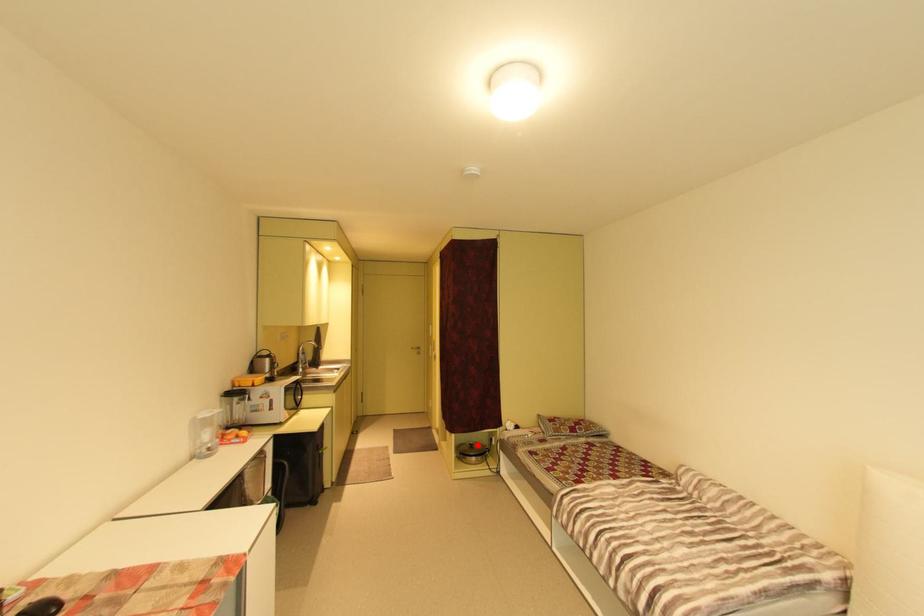
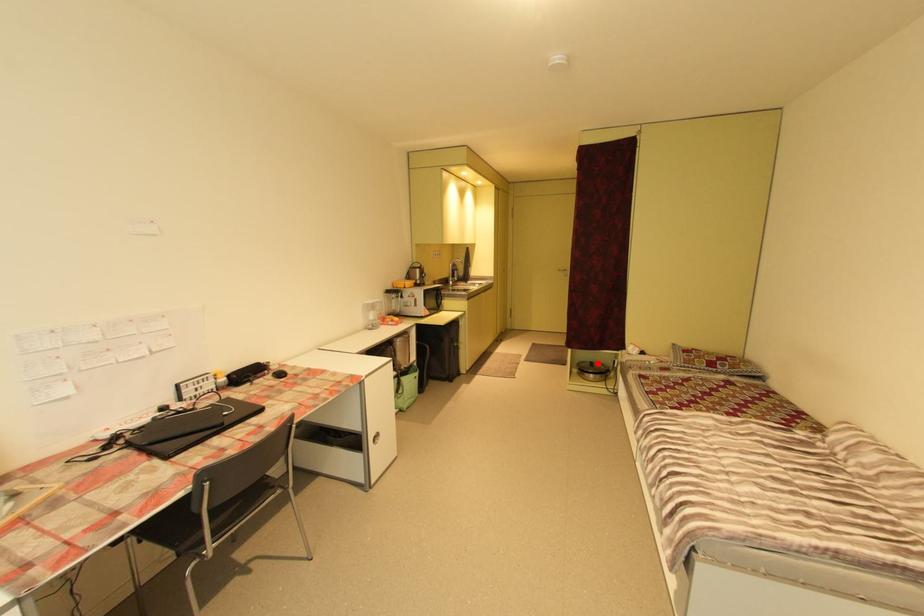
I am providing you with two images of the same scene from different viewpoints. A red point is marked on the first image and another point is marked on the second image. Is the marked point in image1 the same physical position as the marked point in image2?

Yes